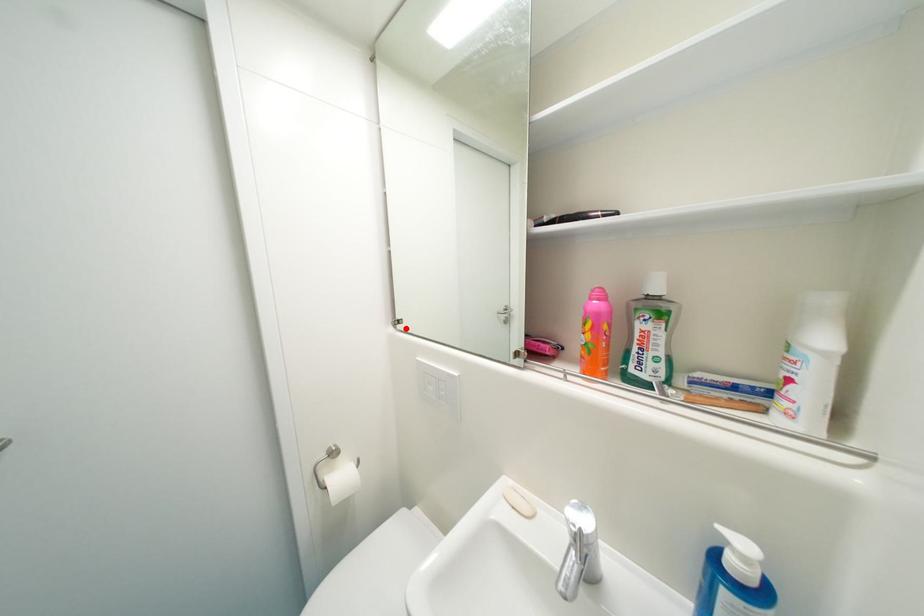
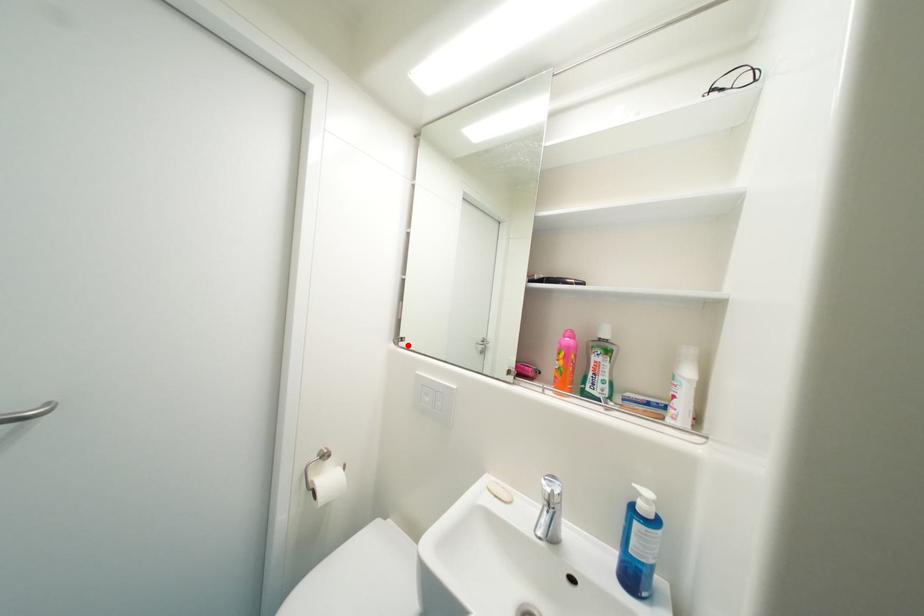
I am providing you with two images of the same scene from different viewpoints. A red point is marked on the first image and another point is marked on the second image. Do the highlighted points in image1 and image2 indicate the same real-world spot?

Yes